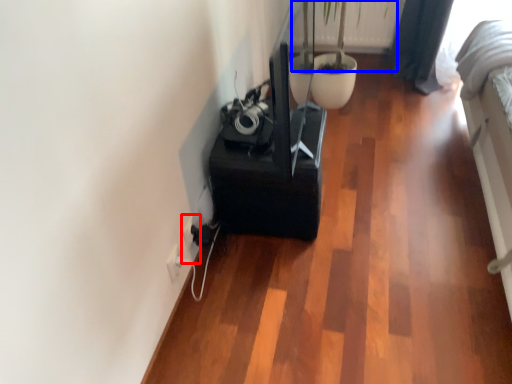
Question: Which object appears farthest to the camera in this image, electric outlet (highlighted by a red box) or plant (highlighted by a blue box)?

Choices:
 (A) electric outlet
 (B) plant

Answer: (B)